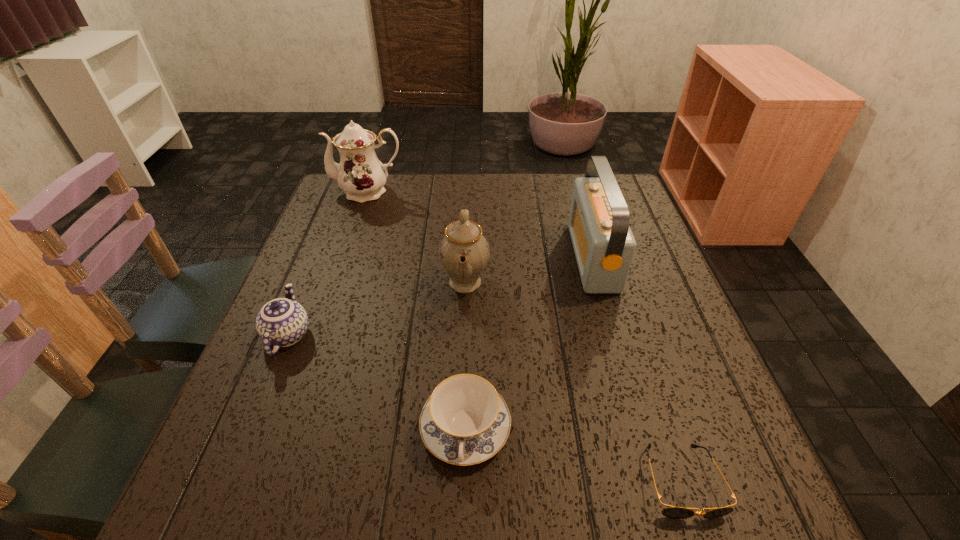
Locate an element on the screen. free region at the far edge of the desktop is located at coordinates (569, 195).

Image resolution: width=960 pixels, height=540 pixels. Identify the location of free region at the near edge of the desktop. (458, 494).

The height and width of the screenshot is (540, 960). I want to click on blank space at the left edge of the desktop, so click(x=279, y=377).

The width and height of the screenshot is (960, 540). Identify the location of vacant space at the right edge of the desktop. (684, 392).

Find the location of a particular element. This screenshot has height=540, width=960. vacant area at the far left corner is located at coordinates (343, 213).

What are the coordinates of `blank region between the shortest chinaware and the sunglasses` in the screenshot? It's located at click(573, 455).

Locate an element on the screen. vacant space that is in between the farthest object and the fourth tallest object is located at coordinates (328, 263).

Locate an element on the screen. Image resolution: width=960 pixels, height=540 pixels. free space between the radio receiver and the shortest chinaware is located at coordinates (529, 343).

The width and height of the screenshot is (960, 540). I want to click on empty space that is in between the farthest object and the radio receiver, so click(480, 224).

Identify the location of vacant region between the second shortest object and the shortest object. tap(573, 455).